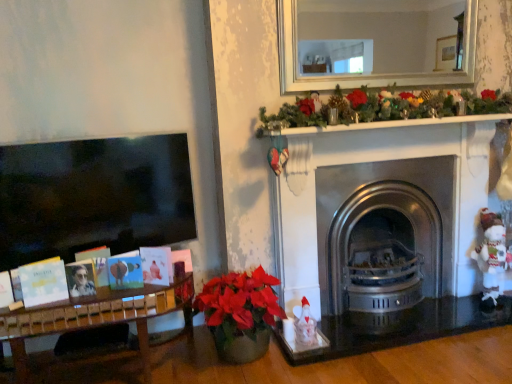
Question: From the image's perspective, is matte black photo frame at left positioned above or below white knitted toy at right?

Choices:
 (A) above
 (B) below

Answer: (B)

Question: From a real-world perspective, is matte black photo frame at left physically located above or below white knitted toy at right?

Choices:
 (A) below
 (B) above

Answer: (B)

Question: Which of these objects is positioned closest to the polished stainless steel fireplace at center?

Choices:
 (A) matte black photo frame at left
 (B) white knitted toy at right

Answer: (B)

Question: Which is farther from the white knitted toy at right?

Choices:
 (A) polished stainless steel fireplace at center
 (B) matte black photo frame at left

Answer: (B)